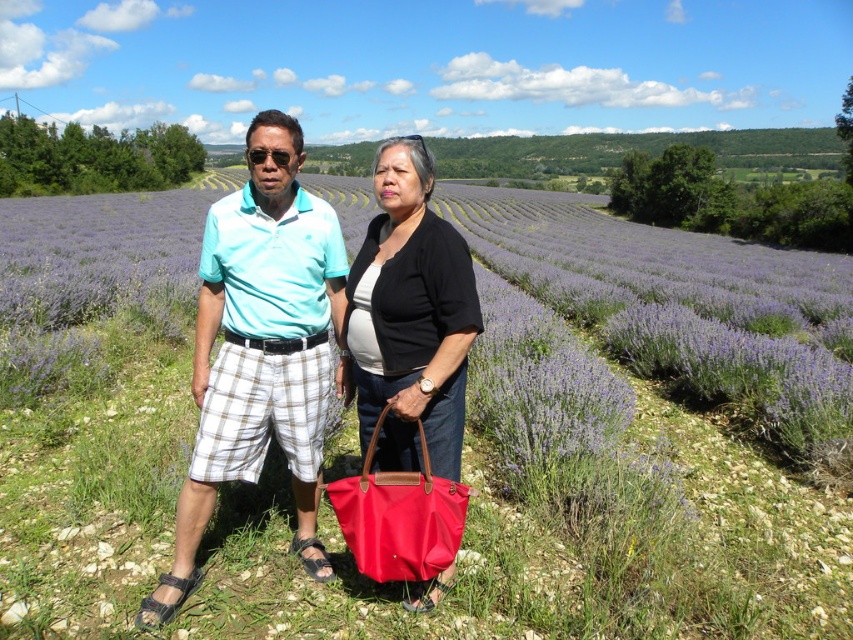
You are a photographer trying to capture a photo of the purple lavender field at center and the red nylon tote at center. The camera you are using has a maximum focus range of 5 meters. Can you focus on both objects simultaneously?

The purple lavender field at center and the red nylon tote at center are 7.96 meters apart. Since the camera has a maximum focus range of 5 meters, it cannot focus on both objects at the same time because the distance between them exceeds the camera range.